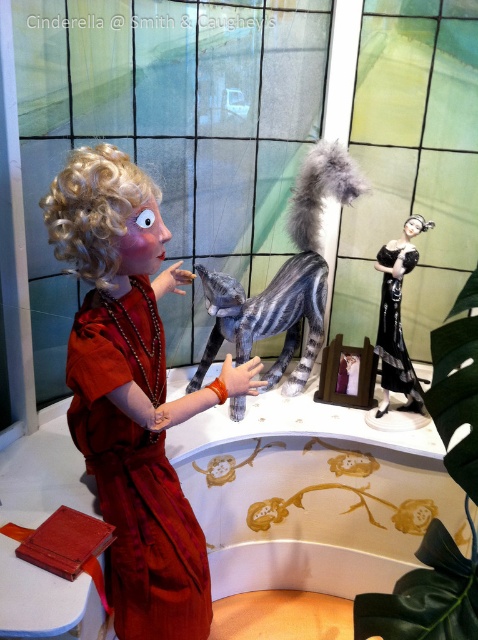
Is satin dress at center to the right of striped fur cat at center from the viewer's perspective?

In fact, satin dress at center is to the left of striped fur cat at center.

What do you see at coordinates (136, 470) in the screenshot? I see `satin dress at center` at bounding box center [136, 470].

Between point (158, 394) and point (307, 160), which one is positioned in front?

Point (158, 394) is in front.

Where is `satin dress at center`? This screenshot has width=478, height=640. satin dress at center is located at coordinates (136, 470).

Is matte red dress at center shorter than black satin dress at center?

No, matte red dress at center is not shorter than black satin dress at center.

What do you see at coordinates (132, 392) in the screenshot?
I see `matte red dress at center` at bounding box center [132, 392].

Is point (76, 188) positioned after point (386, 300)?

No, (76, 188) is in front of (386, 300).

Identify the location of matte red dress at center. The image size is (478, 640). (132, 392).

Who is more forward, (202, 374) or (402, 348)?

Point (402, 348) is more forward.

Between point (325, 173) and point (386, 253), which one is positioned in front?

Point (325, 173) is more forward.

At what (x,y) coordinates should I click in order to perform the action: click on striped fur cat at center. Please return your answer as a coordinate pair (x, y). This screenshot has height=640, width=478. Looking at the image, I should click on (283, 278).